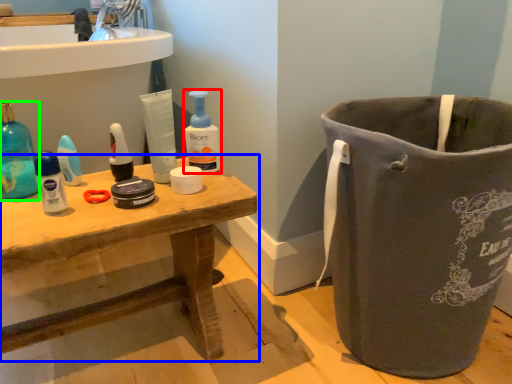
Question: Based on their relative distances, which object is farther from cleaning product (highlighted by a red box)? Choose from table (highlighted by a blue box) and cleaning product (highlighted by a green box).

Choices:
 (A) table
 (B) cleaning product

Answer: (B)